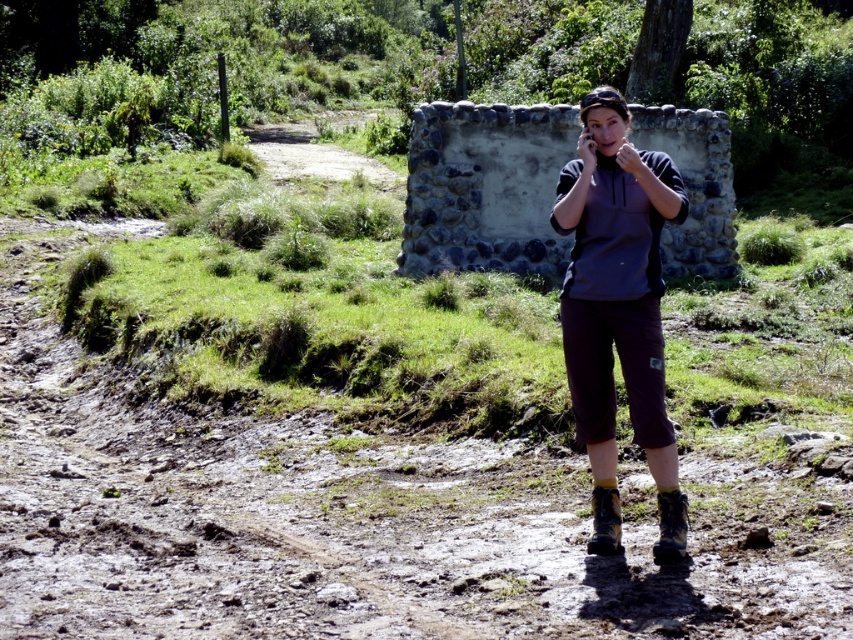
You are standing on the muddy path and want to walk towards the stone structure behind the person. Which point, point (660, 516) or point (589, 538), is closer to you as you start walking towards the stone structure?

Point (660, 516) is closer to the viewer than point (589, 538), so it will be closer to you as you walk towards the stone structure.

You are a hiker trying to find your way back to the trail. You see the dusty brown dirt track at lower left and the dark gray fleece at center. Which object is closer to you?

The dusty brown dirt track at lower left is in front of the dark gray fleece at center, so it is closer to you.